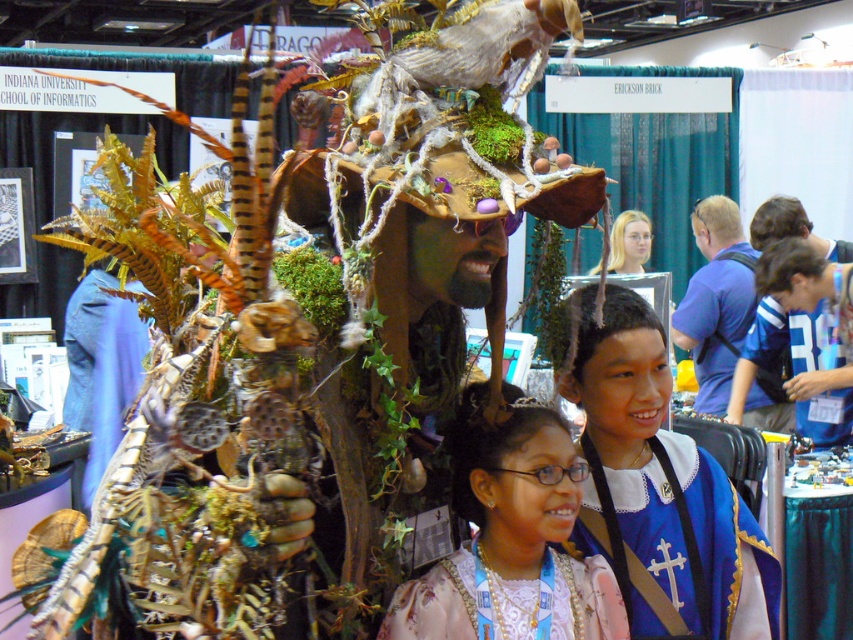
Question: Which object appears closest to the camera in this image?

Choices:
 (A) pearl necklace at center
 (B) blue velvet sash at center
 (C) blue fabric shirt at right
 (D) blonde hair at upper center

Answer: (A)

Question: Does blue velvet sash at center have a smaller size compared to blonde hair at upper center?

Choices:
 (A) yes
 (B) no

Answer: (A)

Question: Among these objects, which one is farthest from the camera?

Choices:
 (A) blue fabric shirt at right
 (B) pearl necklace at center
 (C) blonde hair at upper center

Answer: (C)

Question: Among these points, which one is nearest to the camera?

Choices:
 (A) (613, 253)
 (B) (428, 596)
 (C) (728, 483)

Answer: (B)

Question: Is blue velvet sash at center positioned behind blonde hair at upper center?

Choices:
 (A) yes
 (B) no

Answer: (B)

Question: Does blue velvet sash at center have a lesser width compared to pearl necklace at center?

Choices:
 (A) no
 (B) yes

Answer: (A)